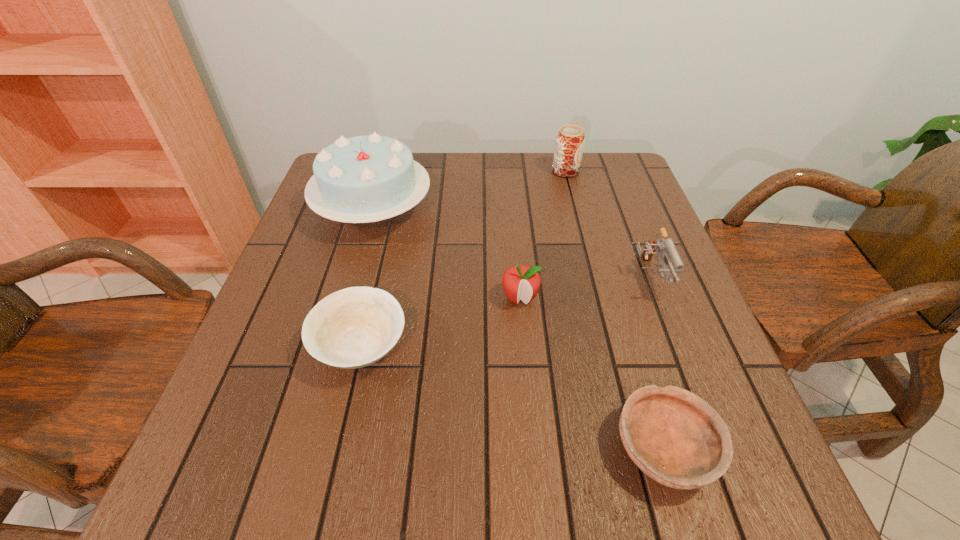
What are the coordinates of `blank area located at the barrel end of the gun` in the screenshot? It's located at (689, 384).

Find the location of a particular element. This screenshot has height=540, width=960. vacant space located on the front of the apple is located at coordinates (528, 396).

This screenshot has height=540, width=960. Find the location of `vacant point located on the right of the left bowl`. vacant point located on the right of the left bowl is located at coordinates (456, 348).

Locate an element on the screen. The width and height of the screenshot is (960, 540). free region located on the left of the nearest object is located at coordinates (538, 449).

I want to click on birthday cake that is at the far edge, so [x=361, y=179].

Find the location of a particular element. The height and width of the screenshot is (540, 960). beer can situated at the far edge is located at coordinates (570, 140).

I want to click on object located at the near edge, so click(676, 438).

The height and width of the screenshot is (540, 960). In order to click on birthday cake at the left edge in this screenshot , I will do `click(361, 179)`.

Locate an element on the screen. The width and height of the screenshot is (960, 540). bowl located in the left edge section of the desktop is located at coordinates click(354, 327).

The width and height of the screenshot is (960, 540). Identify the location of beer can situated at the right edge. (570, 140).